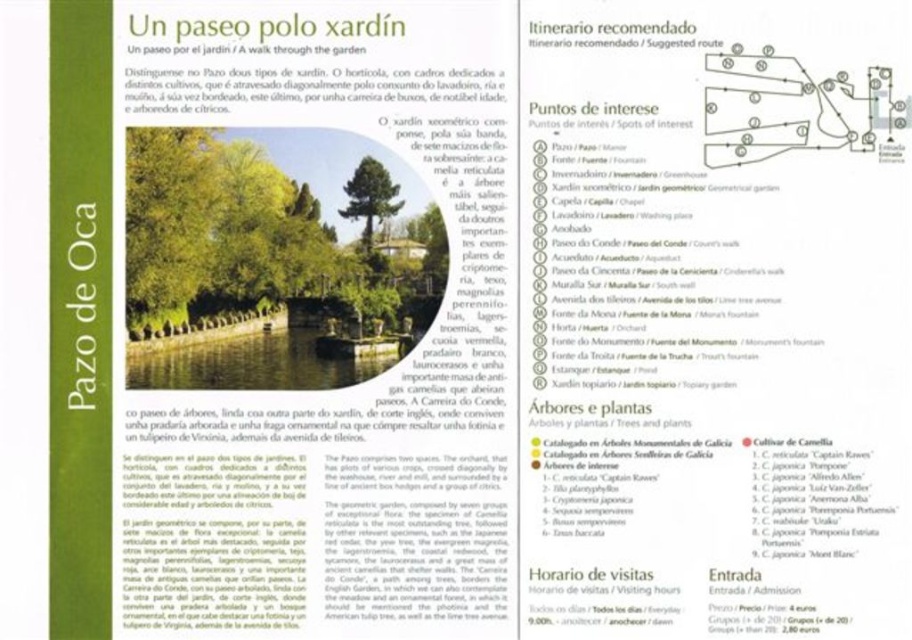
Looking at this image, you are looking at the promotional leaflet for Pazo de Oca and see the two sections at the upper center. The green paper at upper center and the white paper at upper center. Which one is taller?

The green paper at upper center is much taller than the white paper at upper center.

You are looking at a leaflet for Pazo de Oca and see the green paper at upper center and the white paper at upper center. Which one is closer to you?

The white paper at upper center is closer to you because it is positioned over the green paper at upper center.

You are a visitor looking at the leaflet for Pazo de Oca. You see the green paper at upper center. Where is it located on the leaflet?

The green paper at upper center is located at point (301, 86) on the leaflet.